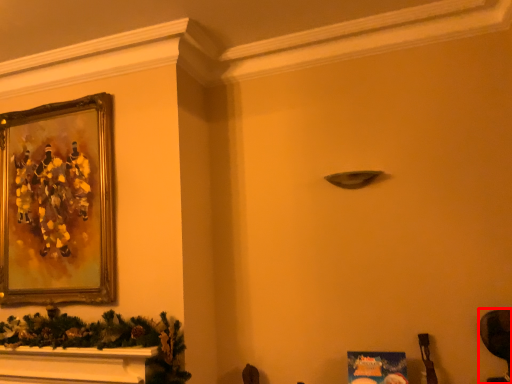
Question: From the image's perspective, considering the relative positions of swivel chair (annotated by the red box) and picture frame in the image provided, where is swivel chair (annotated by the red box) located with respect to the staircase?

Choices:
 (A) above
 (B) below

Answer: (B)